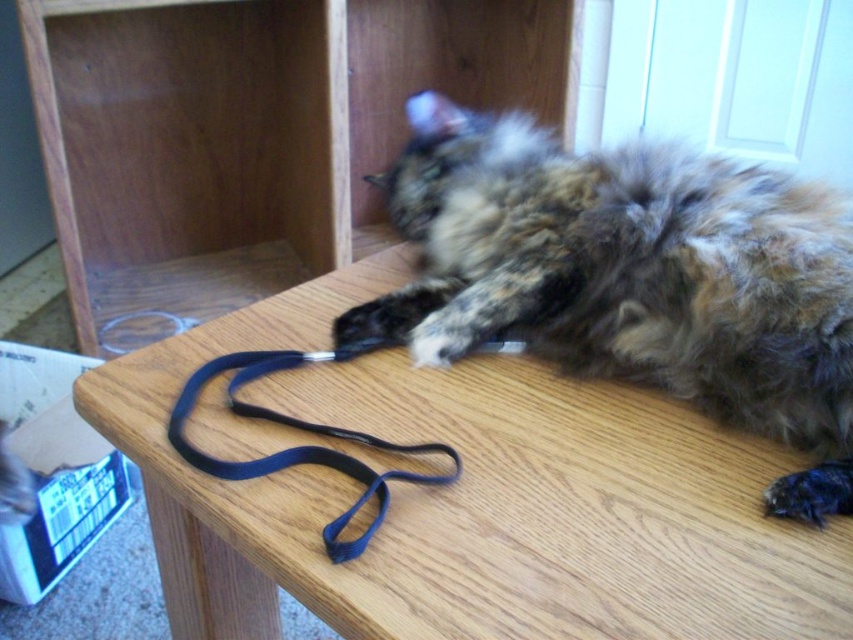
Identify the location of wooden at upper left. Image resolution: width=853 pixels, height=640 pixels. (248, 131).

Is wooden at upper left bigger than fluffy fur cat at center?

Correct, wooden at upper left is larger in size than fluffy fur cat at center.

The height and width of the screenshot is (640, 853). I want to click on wooden at upper left, so click(x=248, y=131).

Between wooden at upper left and blue fabric strap at center, which one is positioned higher?

Positioned higher is wooden at upper left.

Who is more distant from viewer, (44,115) or (341,456)?

Positioned behind is point (44,115).

Who is more distant from viewer, (433, 28) or (173, 420)?

The point (433, 28) is more distant.

This screenshot has height=640, width=853. What are the coordinates of `wooden at upper left` in the screenshot? It's located at (248, 131).

From the picture: Can you confirm if wooden table at center is thinner than wooden at upper left?

Yes.

What do you see at coordinates (471, 499) in the screenshot? I see `wooden table at center` at bounding box center [471, 499].

Locate an element on the screen. wooden table at center is located at coordinates (471, 499).